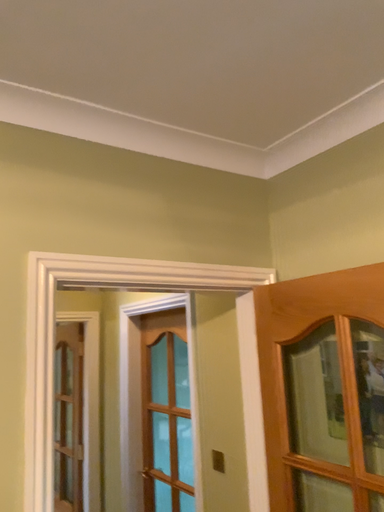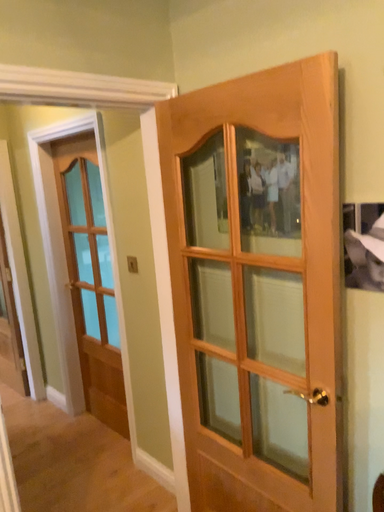
Question: Which way did the camera rotate in the video?

Choices:
 (A) rotated left
 (B) rotated right

Answer: (B)